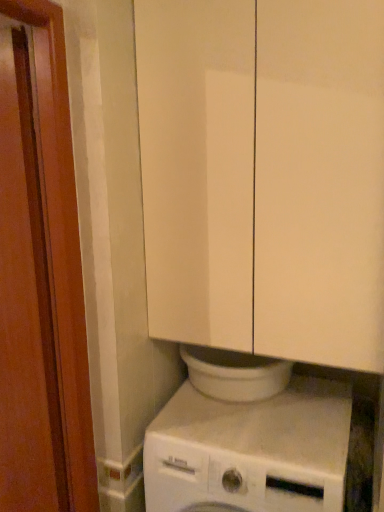
Question: Considering the relative sizes of brown wood screen door at left and white glossy cabinet at upper center in the image provided, is brown wood screen door at left taller than white glossy cabinet at upper center?

Choices:
 (A) yes
 (B) no

Answer: (A)

Question: Is brown wood screen door at left thinner than white glossy cabinet at upper center?

Choices:
 (A) yes
 (B) no

Answer: (A)

Question: Is brown wood screen door at left oriented towards white glossy cabinet at upper center?

Choices:
 (A) yes
 (B) no

Answer: (B)

Question: From the image's perspective, is brown wood screen door at left located beneath white glossy cabinet at upper center?

Choices:
 (A) no
 (B) yes

Answer: (B)

Question: Is brown wood screen door at left in contact with white glossy cabinet at upper center?

Choices:
 (A) yes
 (B) no

Answer: (B)

Question: From a real-world perspective, is white matte washing machine at lower center positioned above or below white glossy cabinet at upper center?

Choices:
 (A) above
 (B) below

Answer: (B)

Question: From the image's perspective, is white matte washing machine at lower center above or below white glossy cabinet at upper center?

Choices:
 (A) above
 (B) below

Answer: (B)

Question: Would you say white matte washing machine at lower center is to the left or to the right of white glossy cabinet at upper center in the picture?

Choices:
 (A) left
 (B) right

Answer: (A)

Question: Is point [x=228, y=441] closer or farther from the camera than point [x=155, y=327]?

Choices:
 (A) farther
 (B) closer

Answer: (B)

Question: From a real-world perspective, is white glossy cabinet at upper center above or below white matte washing machine at lower center?

Choices:
 (A) below
 (B) above

Answer: (B)

Question: Based on their positions, is white glossy cabinet at upper center located to the left or right of white matte washing machine at lower center?

Choices:
 (A) left
 (B) right

Answer: (B)

Question: In the image, is white glossy cabinet at upper center positioned in front of or behind white matte washing machine at lower center?

Choices:
 (A) front
 (B) behind

Answer: (A)

Question: Considering the positions of point (175, 302) and point (314, 385), is point (175, 302) closer or farther from the camera than point (314, 385)?

Choices:
 (A) farther
 (B) closer

Answer: (B)

Question: Would you say white glossy cabinet at upper center is to the left or to the right of brown wood screen door at left in the picture?

Choices:
 (A) right
 (B) left

Answer: (A)

Question: Looking at the image, does white glossy cabinet at upper center seem bigger or smaller compared to brown wood screen door at left?

Choices:
 (A) small
 (B) big

Answer: (B)